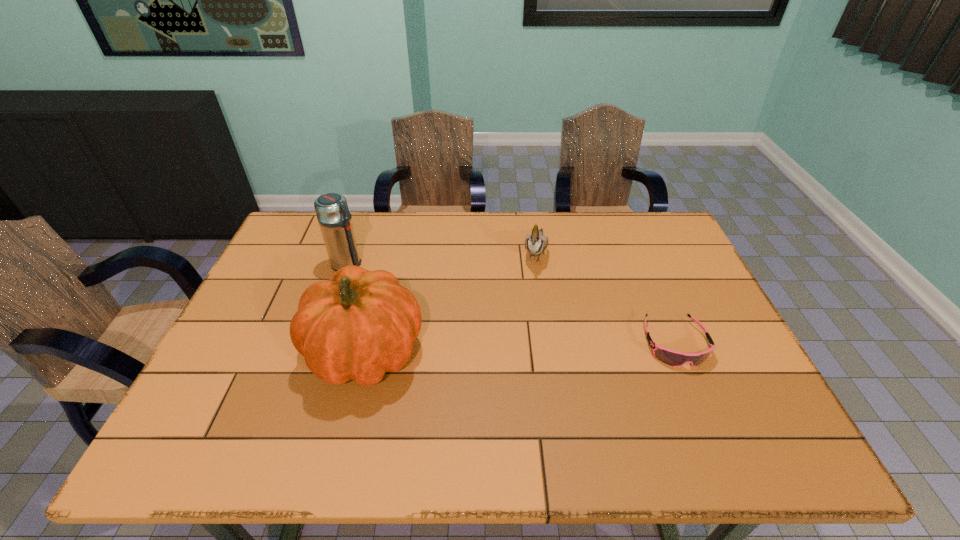
The width and height of the screenshot is (960, 540). Find the location of `free space located 0.380m with a handle on the side of the thermos bottle`. free space located 0.380m with a handle on the side of the thermos bottle is located at coordinates (465, 317).

Locate an element on the screen. free point located at the face of the bird is located at coordinates (509, 377).

Find the location of `free point located at the face of the bird`. free point located at the face of the bird is located at coordinates (512, 364).

Where is `vacant space located 0.130m at the face of the bird`? The image size is (960, 540). vacant space located 0.130m at the face of the bird is located at coordinates (527, 305).

Locate an element on the screen. thermos bottle situated at the far edge is located at coordinates (334, 217).

Identify the location of bird that is at the far edge. The width and height of the screenshot is (960, 540). (535, 243).

Where is `object present at the near edge`? This screenshot has width=960, height=540. object present at the near edge is located at coordinates (360, 324).

In order to click on object situated at the right edge in this screenshot , I will do `click(673, 358)`.

This screenshot has width=960, height=540. In the image, there is a desktop. Identify the location of vacant space at the far edge. (400, 254).

The width and height of the screenshot is (960, 540). I want to click on vacant space at the near edge, so click(x=363, y=411).